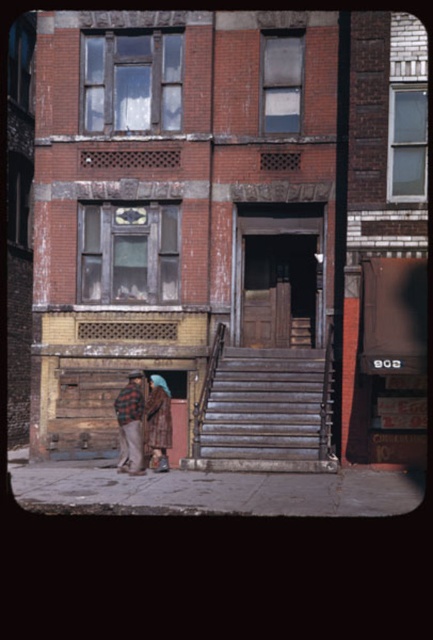
Is rusty metal stairs at center wider than plaid flannel shirt at lower left?

Correct, the width of rusty metal stairs at center exceeds that of plaid flannel shirt at lower left.

Is point (265, 460) farther from camera compared to point (138, 376)?

No, (265, 460) is closer to viewer.

Does point (235, 400) lie behind point (113, 404)?

That is False.

Locate an element on the screen. rusty metal stairs at center is located at coordinates (267, 412).

Which is in front, point (225, 464) or point (165, 452)?

Positioned in front is point (225, 464).

Is the position of rusty metal stairs at center more distant than that of brown textured coat at lower left?

That is False.

Who is more forward, (216,369) or (158,422)?

Point (158,422)

The image size is (433, 640). Identify the location of rusty metal stairs at center. (267, 412).

Between plaid flannel shirt at lower left and brown textured coat at lower left, which one appears on the left side from the viewer's perspective?

plaid flannel shirt at lower left

Can you confirm if plaid flannel shirt at lower left is bigger than brown textured coat at lower left?

Yes.

Locate an element on the screen. The image size is (433, 640). plaid flannel shirt at lower left is located at coordinates (129, 424).

Where is `plaid flannel shirt at lower left`? plaid flannel shirt at lower left is located at coordinates (129, 424).